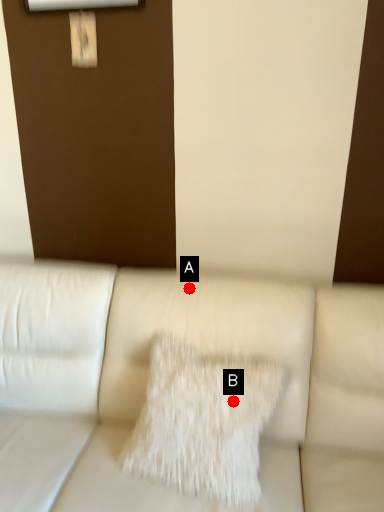
Question: Two points are circled on the image, labeled by A and B beside each circle. Which point is farther from the camera taking this photo?

Choices:
 (A) A is further
 (B) B is further

Answer: (A)